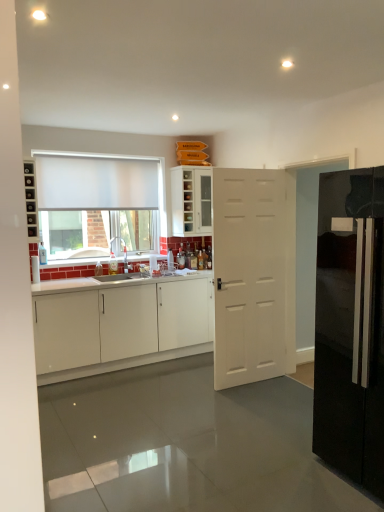
Question: Is the position of white matte door at center less distant than that of white matte cabinet at left, which is the 1th cabinetry in bottom-to-top order?

Choices:
 (A) no
 (B) yes

Answer: (B)

Question: Does white matte door at center turn towards white matte cabinet at left, the second cabinetry when ordered from top to bottom?

Choices:
 (A) yes
 (B) no

Answer: (B)

Question: From the image's perspective, is white matte door at center beneath white matte cabinet at left, the second cabinetry when ordered from top to bottom?

Choices:
 (A) yes
 (B) no

Answer: (B)

Question: From a real-world perspective, does white matte door at center stand above white matte cabinet at left, which is the 1th cabinetry in bottom-to-top order?

Choices:
 (A) no
 (B) yes

Answer: (B)

Question: Is white matte door at center positioned far away from white matte cabinet at left, which is the 1th cabinetry in bottom-to-top order?

Choices:
 (A) yes
 (B) no

Answer: (A)

Question: Is white matte door at center oriented away from white matte cabinet at left, which is the 1th cabinetry in bottom-to-top order?

Choices:
 (A) no
 (B) yes

Answer: (A)

Question: Is white matte window at upper left positioned behind matte black shelves at left?

Choices:
 (A) yes
 (B) no

Answer: (A)

Question: Is matte black shelves at left located within white matte window at upper left?

Choices:
 (A) yes
 (B) no

Answer: (B)

Question: From a real-world perspective, is white matte window at upper left positioned over matte black shelves at left based on gravity?

Choices:
 (A) no
 (B) yes

Answer: (A)

Question: Is white matte window at upper left looking in the opposite direction of matte black shelves at left?

Choices:
 (A) no
 (B) yes

Answer: (A)

Question: From the image's perspective, is white matte window at upper left located above matte black shelves at left?

Choices:
 (A) no
 (B) yes

Answer: (B)

Question: Considering the relative sizes of white matte window at upper left and matte black shelves at left in the image provided, is white matte window at upper left smaller than matte black shelves at left?

Choices:
 (A) yes
 (B) no

Answer: (B)

Question: Is matte black shelves at left behind glossy black refrigerator at right?

Choices:
 (A) no
 (B) yes

Answer: (B)